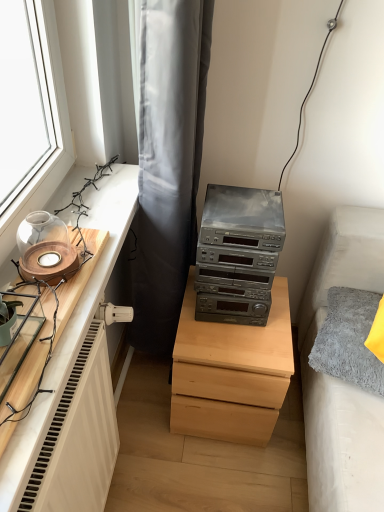
Question: Is wooden tray at left in front of or behind metallic gray stereo at center in the image?

Choices:
 (A) behind
 (B) front

Answer: (B)

Question: Is wooden tray at left inside or outside of metallic gray stereo at center?

Choices:
 (A) inside
 (B) outside

Answer: (B)

Question: Which object is positioned closest to the gray fabric curtain at upper center?

Choices:
 (A) gray fluffy pillow at right
 (B) light wood chest of drawers at center
 (C) metallic gray stereo at center
 (D) wooden candle holder at left
 (E) wooden tray at left

Answer: (C)

Question: Considering the real-world distances, which object is farthest from the metallic gray stereo at center?

Choices:
 (A) light wood chest of drawers at center
 (B) gray fluffy pillow at right
 (C) wooden candle holder at left
 (D) gray fabric curtain at upper center
 (E) wooden tray at left

Answer: (C)